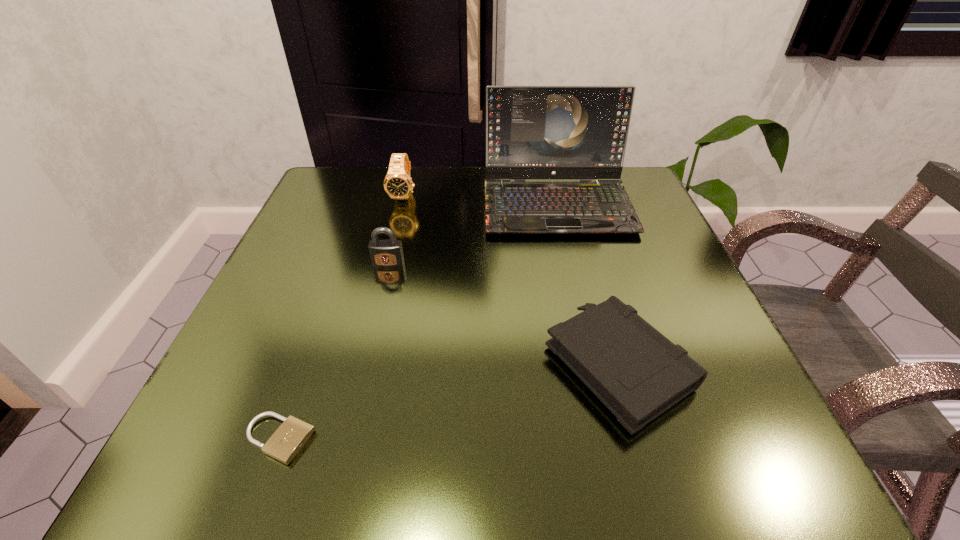
Locate an element on the screen. This screenshot has width=960, height=540. object at the far right corner is located at coordinates (532, 132).

The height and width of the screenshot is (540, 960). Find the location of `object located in the near right corner section of the desktop`. object located in the near right corner section of the desktop is located at coordinates (636, 372).

In the image, there is a desktop. Where is `free region at the far edge`? The height and width of the screenshot is (540, 960). free region at the far edge is located at coordinates (465, 172).

Where is `free spot at the near edge of the desktop`? Image resolution: width=960 pixels, height=540 pixels. free spot at the near edge of the desktop is located at coordinates (535, 448).

In the image, there is a desktop. Where is `vacant space at the left edge`? vacant space at the left edge is located at coordinates (242, 347).

In the image, there is a desktop. At what (x,y) coordinates should I click in order to perform the action: click on vacant space at the right edge. Please return your answer as a coordinate pair (x, y). The width and height of the screenshot is (960, 540). Looking at the image, I should click on (592, 244).

Identify the location of free location at the far left corner. The image size is (960, 540). (315, 202).

At what (x,y) coordinates should I click in order to perform the action: click on free location at the near left corner of the desktop. Please return your answer as a coordinate pair (x, y). Looking at the image, I should click on (218, 423).

Identify the location of vacant space at the far right corner. This screenshot has width=960, height=540. (636, 179).

Identify the location of vacant space that's between the Bible and the third tallest object. (503, 314).